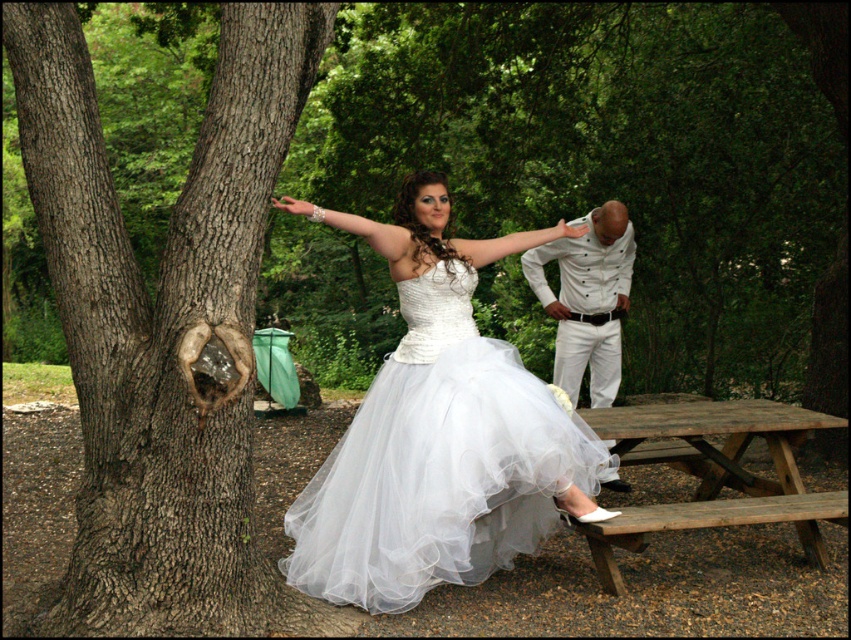
Question: Among these objects, which one is farthest from the camera?

Choices:
 (A) brown rough bark tree at left
 (B) wooden picnic table at lower right
 (C) white textured shirt at center

Answer: (C)

Question: Does wooden picnic table at lower right have a lesser width compared to white textured shirt at center?

Choices:
 (A) yes
 (B) no

Answer: (B)

Question: Does brown rough bark tree at left have a lesser width compared to white tulle dress at center?

Choices:
 (A) yes
 (B) no

Answer: (A)

Question: Is white tulle dress at center bigger than white textured shirt at center?

Choices:
 (A) no
 (B) yes

Answer: (B)

Question: Among these points, which one is nearest to the camera?

Choices:
 (A) 244,16
 (B) 617,584
 (C) 391,488

Answer: (A)

Question: Which object is the farthest from the brown rough bark tree at left?

Choices:
 (A) white tulle dress at center
 (B) white textured shirt at center
 (C) wooden picnic table at lower right

Answer: (B)